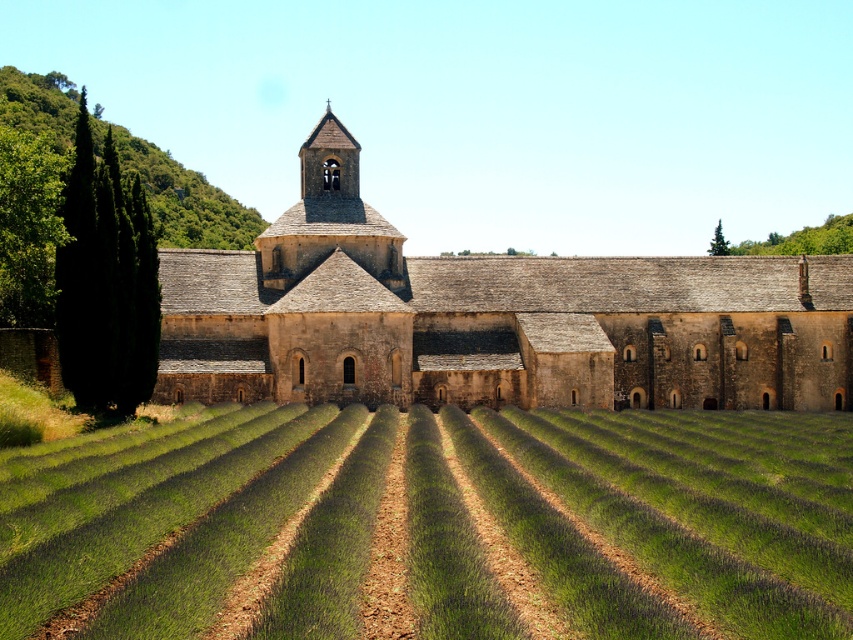
You are standing at the entrance of the historic stone building and want to find the green grass at center. According to the coordinates provided, in which direction should you walk to reach it?

The green grass at center is located at coordinates point (674,515). Since the coordinates are both greater than 0.5, this indicates it is positioned towards the lower right of the image. Therefore, you should walk towards the lower right direction to reach the green grass at center.

You are standing in the lavender field looking at the historic stone building. There are two points marked in the scene. Which point is closer to you, point (299,442) or point (113,125)?

Point (299,442) is closer to the viewer than point (113,125).

Consider the image. You are a landscape architect designing a garden path between the green grass at center and the green leafy hillside at upper left. Which area would require more soil to create a raised bed, and why?

The green leafy hillside at upper left would require more soil for a raised bed because it is thicker than the green grass at center, indicating it has a denser growth or deeper root system.